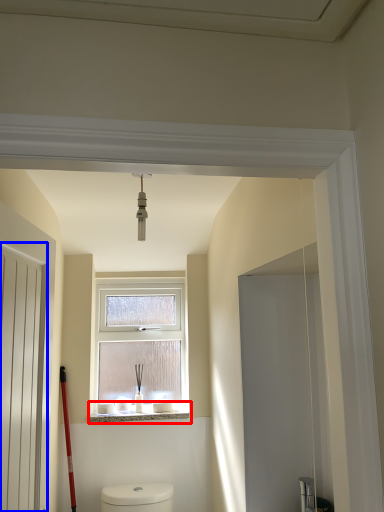
Question: Which point is closer to the camera, window sill (highlighted by a red box) or screen door (highlighted by a blue box)?

Choices:
 (A) window sill
 (B) screen door

Answer: (B)